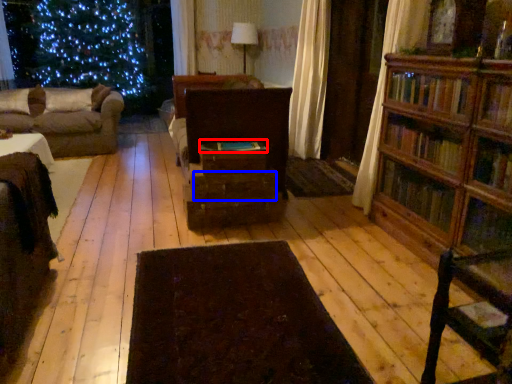
Question: Which of the following is the closest to the observer, book (highlighted by a red box) or drawer (highlighted by a blue box)?

Choices:
 (A) book
 (B) drawer

Answer: (B)